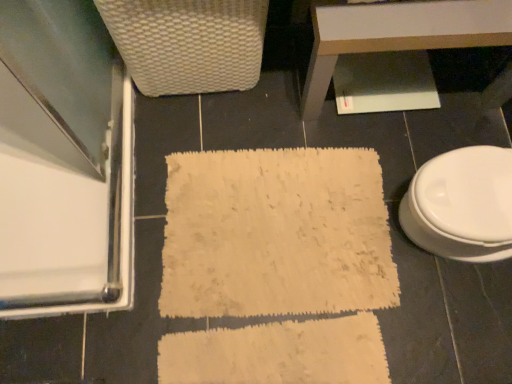
Find the location of a particular element. The width and height of the screenshot is (512, 384). white glossy toilet at right is located at coordinates (462, 205).

This screenshot has width=512, height=384. What do you see at coordinates (276, 233) in the screenshot?
I see `white textured bath mat at center` at bounding box center [276, 233].

The height and width of the screenshot is (384, 512). Identify the location of white glossy toilet at right. (462, 205).

From the picture: In the image, is white textured bath mat at center positioned in front of or behind white glossy table at upper center?

Clearly, white textured bath mat at center is behind white glossy table at upper center.

From a real-world perspective, is white textured bath mat at center positioned above or below white glossy table at upper center?

white textured bath mat at center is situated lower than white glossy table at upper center in the real world.

Is there a large distance between white textured bath mat at center and white glossy table at upper center?

No, white textured bath mat at center is in close proximity to white glossy table at upper center.

Can you confirm if white glossy table at upper center is shorter than clear glass screen door at left?

In fact, white glossy table at upper center may be taller than clear glass screen door at left.

Considering the sizes of objects white glossy table at upper center and clear glass screen door at left in the image provided, who is bigger, white glossy table at upper center or clear glass screen door at left?

Bigger between the two is white glossy table at upper center.

Consider the image. Is white glossy table at upper center facing towards white glossy toilet at right?

Yes, white glossy table at upper center faces towards white glossy toilet at right.

Is white glossy toilet at right located within white glossy table at upper center?

No, white glossy toilet at right is not surrounded by white glossy table at upper center.

From the image's perspective, which one is positioned higher, white glossy table at upper center or white glossy toilet at right?

From the image's view, white glossy table at upper center is above.

In terms of size, does white glossy table at upper center appear bigger or smaller than white glossy toilet at right?

Clearly, white glossy table at upper center is larger in size than white glossy toilet at right.

From a real-world perspective, who is located higher, white glossy toilet at right or white textured bath mat at center?

white glossy toilet at right, from a real-world perspective.

Does white glossy toilet at right turn towards white textured bath mat at center?

Yes, white glossy toilet at right is aimed at white textured bath mat at center.

In order to click on bath mat below the white glossy toilet at right (from a real-world perspective) in this screenshot , I will do `click(276, 233)`.

From the image's perspective, which is above, clear glass screen door at left or white textured bath mat at center?

From the image's view, clear glass screen door at left is above.

Is clear glass screen door at left beside white textured bath mat at center?

No.

Considering the relative positions of clear glass screen door at left and white textured bath mat at center in the image provided, is clear glass screen door at left to the left or to the right of white textured bath mat at center?

Based on their positions, clear glass screen door at left is located to the left of white textured bath mat at center.

Which is behind, clear glass screen door at left or white textured bath mat at center?

clear glass screen door at left.

Find the location of a particular element. The height and width of the screenshot is (384, 512). bath mat below the white glossy table at upper center (from the image's perspective) is located at coordinates (276, 233).

Considering their positions, is white glossy table at upper center located in front of or behind white textured bath mat at center?

Clearly, white glossy table at upper center is in front of white textured bath mat at center.

Measure the distance from white glossy table at upper center to white textured bath mat at center.

A distance of 14.56 inches exists between white glossy table at upper center and white textured bath mat at center.

Between clear glass screen door at left and white glossy table at upper center, which one has smaller size?

clear glass screen door at left.

Consider the image. Is clear glass screen door at left positioned with its back to white glossy table at upper center?

No, clear glass screen door at left's orientation is not away from white glossy table at upper center.

Between clear glass screen door at left and white glossy table at upper center, which one is positioned behind?

clear glass screen door at left is further away from the camera.

From a real-world perspective, is clear glass screen door at left beneath white glossy table at upper center?

Yes, from a real-world perspective, clear glass screen door at left is under white glossy table at upper center.

There is a white textured bath mat at center. Where is `table above it (from a real-world perspective)`? The height and width of the screenshot is (384, 512). table above it (from a real-world perspective) is located at coordinates (397, 34).

Where is `screen door on the left of white glossy table at upper center`? The width and height of the screenshot is (512, 384). screen door on the left of white glossy table at upper center is located at coordinates 63,162.

Looking at this image, which object lies further to the anchor point white woven basket at upper left, clear glass screen door at left or white glossy table at upper center?

white glossy table at upper center is further to white woven basket at upper left.

Estimate the real-world distances between objects in this image. Which object is further from white glossy table at upper center, white glossy toilet at right or white textured bath mat at center?

white textured bath mat at center is positioned further to the anchor white glossy table at upper center.

Looking at the image, which one is located closer to white textured bath mat at center, clear glass screen door at left or white glossy toilet at right?

white glossy toilet at right is closer to white textured bath mat at center.

Consider the image. Which object lies nearer to the anchor point clear glass screen door at left, white textured bath mat at center or white woven basket at upper left?

white woven basket at upper left lies closer to clear glass screen door at left than the other object.

Considering their positions, is clear glass screen door at left positioned closer to white glossy table at upper center than white woven basket at upper left?

white woven basket at upper left lies closer to white glossy table at upper center than the other object.

Based on their spatial positions, is white glossy toilet at right or white glossy table at upper center closer to white woven basket at upper left?

Based on the image, white glossy table at upper center appears to be nearer to white woven basket at upper left.

Which object lies further to the anchor point white textured bath mat at center, white glossy toilet at right or white woven basket at upper left?

white woven basket at upper left.

In the scene shown: Which object lies nearer to the anchor point white glossy table at upper center, white woven basket at upper left or white glossy toilet at right?

white woven basket at upper left lies closer to white glossy table at upper center than the other object.

This screenshot has height=384, width=512. In order to click on table between white woven basket at upper left and white glossy toilet at right in this screenshot , I will do click(397, 34).

Identify the location of armchair between clear glass screen door at left and white textured bath mat at center in the horizontal direction. (188, 43).

You are a GUI agent. You are given a task and a screenshot of the screen. Output one action in this format:
    pyautogui.click(x=<x>, y=<y>)
    Task: Click on the bath mat between clear glass screen door at left and white glossy toilet at right from left to right
    Image resolution: width=512 pixels, height=384 pixels.
    Given the screenshot: What is the action you would take?
    pyautogui.click(x=276, y=233)

I want to click on armchair between white glossy table at upper center and white textured bath mat at center in the up-down direction, so click(188, 43).